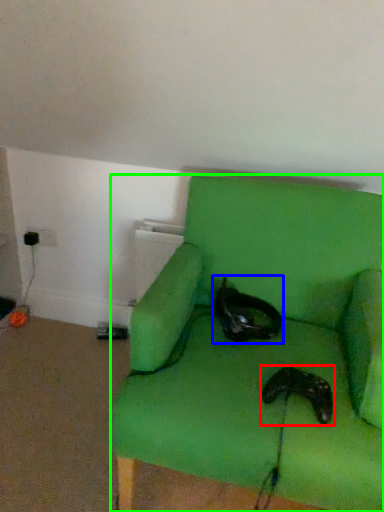
Question: Which object is positioned farthest from footwear (highlighted by a red box)? Select from cat (highlighted by a blue box) and chair (highlighted by a green box).

Choices:
 (A) cat
 (B) chair

Answer: (A)